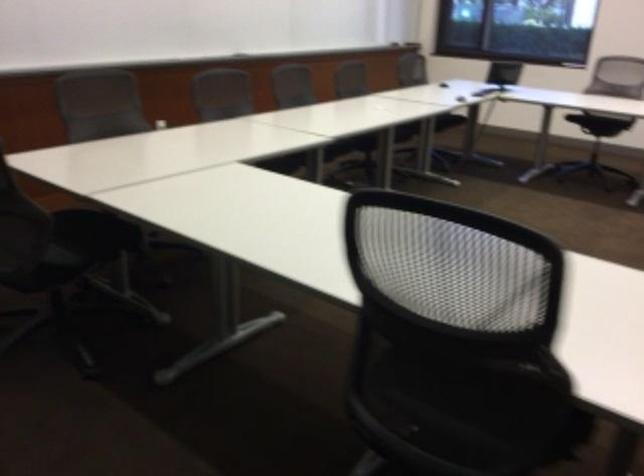
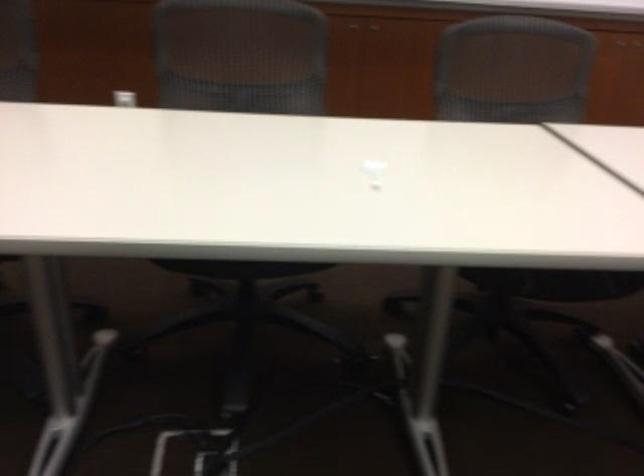
Locate, in the second image, the point that corresponds to (422,131) in the first image.

(556, 283)